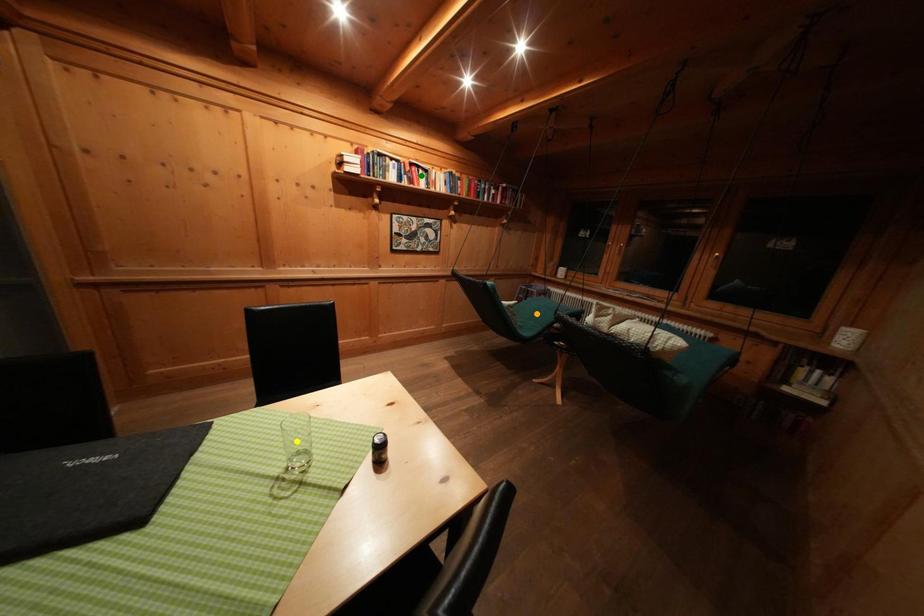
Order these from nearest to farthest:
yellow point | green point | orange point

yellow point < orange point < green point